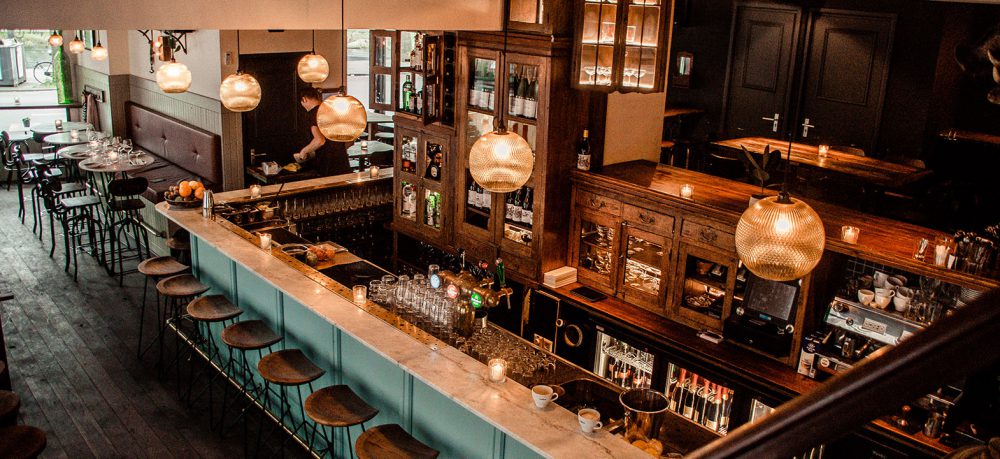
This screenshot has width=1000, height=459. What are the coordinates of `bar stools at bar` in the screenshot? It's located at (173, 268), (181, 288), (212, 313), (253, 343), (294, 363), (334, 406), (388, 446).